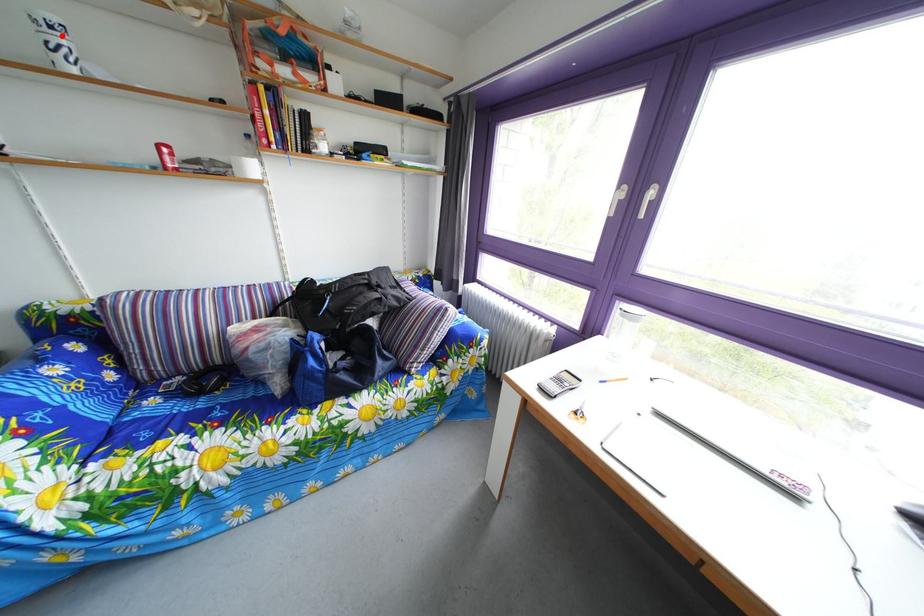
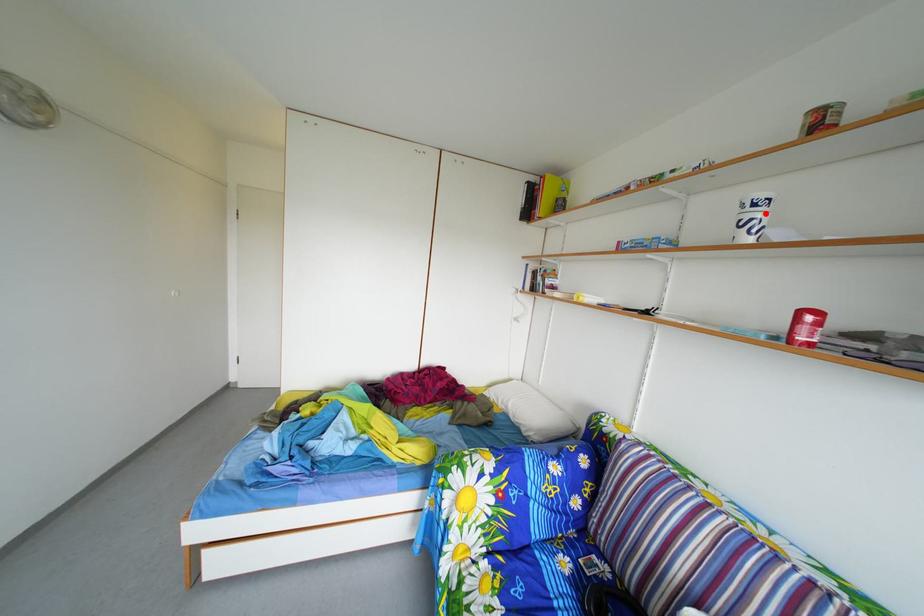
I am providing you with two images of the same scene from different viewpoints. A red point is marked on the first image and another point is marked on the second image. Does the point marked in image1 correspond to the same location as the one in image2?

Yes